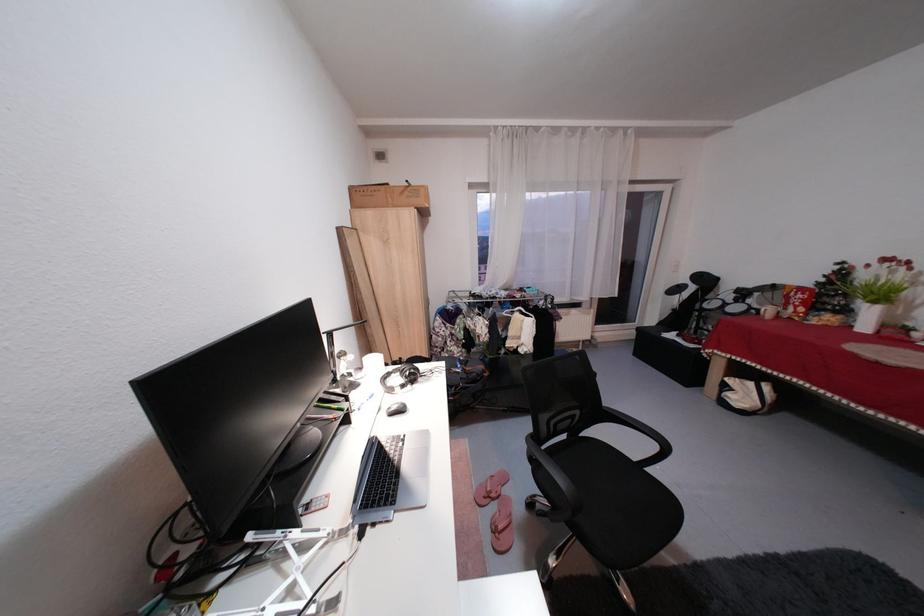
Locate an element on the screen. white flower vase is located at coordinates (881, 290).